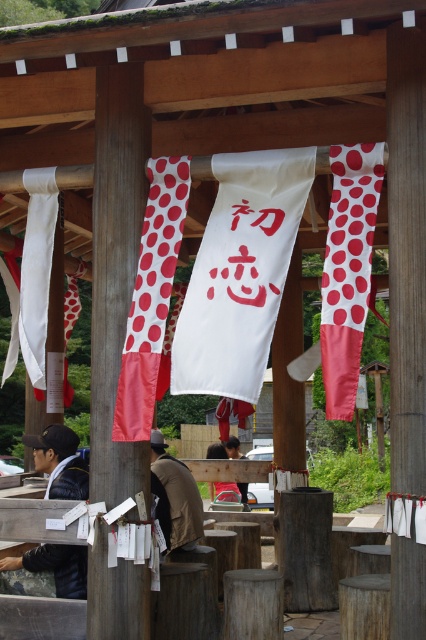
Is wooden post at center closer to the viewer compared to white fabric banner at center?

No.

Can you confirm if wooden post at center is positioned below white fabric banner at center?

Yes.

Locate an element on the screen. wooden post at center is located at coordinates (115, 268).

Does white fabric banner at center appear under black leather jacket at lower left?

No.

Is white fabric banner at center bigger than black leather jacket at lower left?

No.

Describe the element at coordinates (152, 300) in the screenshot. I see `white fabric banner at center` at that location.

Find the location of a particular element. white fabric banner at center is located at coordinates (152, 300).

Who is more forward, (195,529) or (68,397)?

Point (195,529) is in front.

Does brown suede jacket at center have a larger size compared to red dotted fabric at center?

Yes, brown suede jacket at center is bigger than red dotted fabric at center.

Describe the element at coordinates (175, 496) in the screenshot. I see `brown suede jacket at center` at that location.

Locate an element on the screen. The width and height of the screenshot is (426, 640). brown suede jacket at center is located at coordinates (175, 496).